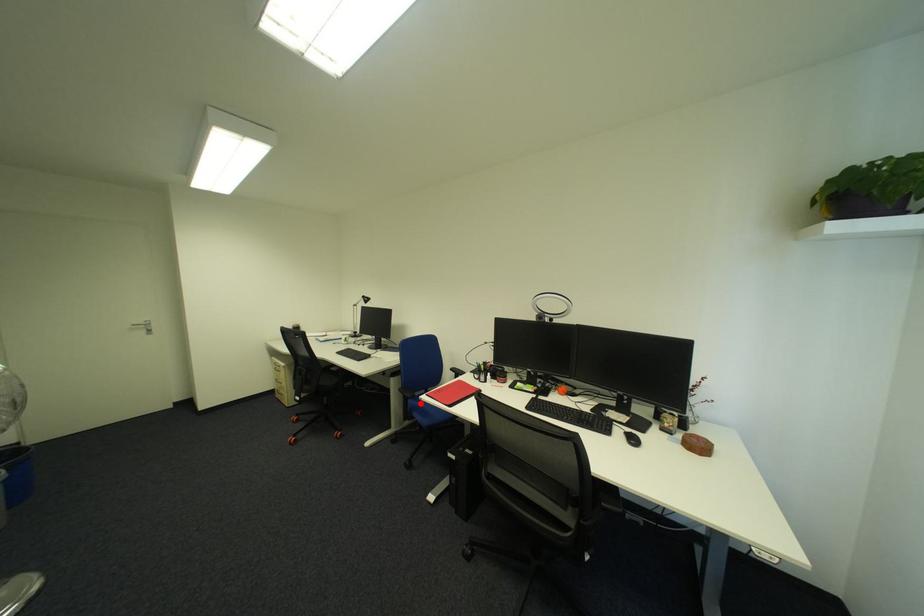
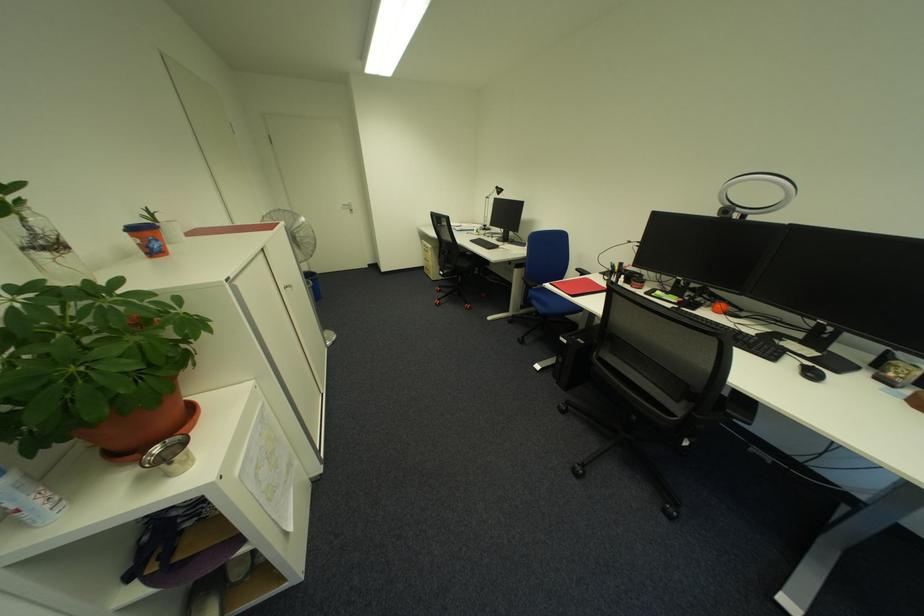
Question: I am providing you with two images of the same scene from different viewpoints. Image1 has a red point marked. In image2, the corresponding 3D location appears at what relative position? Reply with the corresponding letter.

Choices:
 (A) Closer
 (B) Farther

Answer: (A)